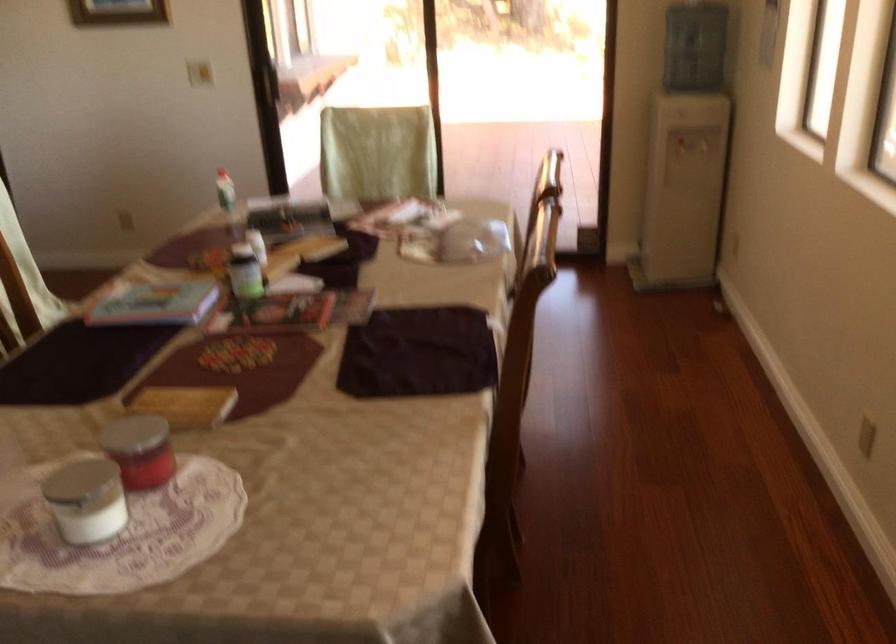
What do you see at coordinates (85, 500) in the screenshot? This screenshot has width=896, height=644. I see `the food cover handle` at bounding box center [85, 500].